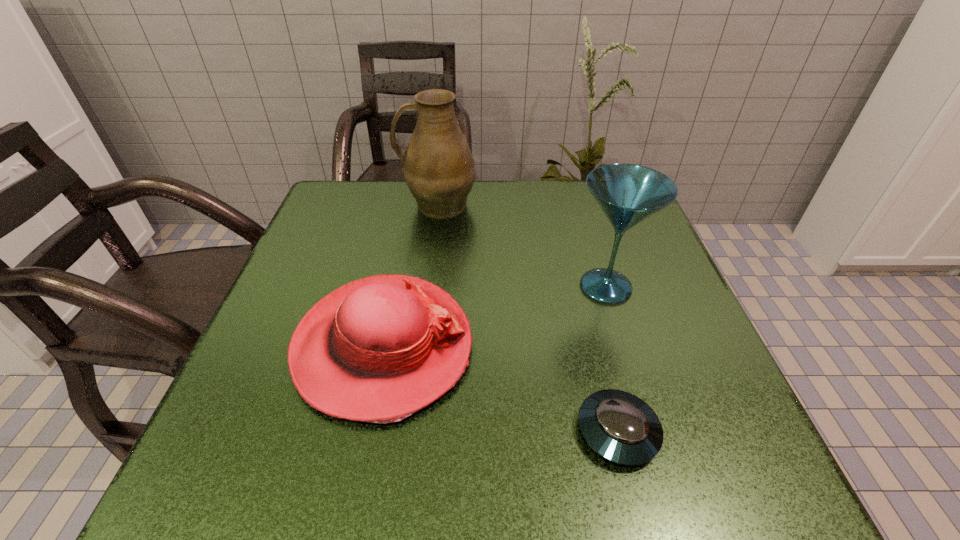
You are a GUI agent. You are given a task and a screenshot of the screen. Output one action in this format:
    pyautogui.click(x=<x>, y=<y>)
    Task: Click on the object located in the far edge section of the desktop
    The image size is (960, 540).
    Given the screenshot: What is the action you would take?
    click(x=438, y=167)

Where is `object that is at the near edge`? object that is at the near edge is located at coordinates (622, 428).

This screenshot has height=540, width=960. Identify the location of object that is at the left edge. (379, 349).

Locate an element on the screen. The width and height of the screenshot is (960, 540). martini that is at the right edge is located at coordinates (628, 194).

This screenshot has width=960, height=540. Identify the location of saucer situated at the right edge. [x=622, y=428].

At what (x,y) coordinates should I click in order to perform the action: click on object that is positioned at the near right corner. Please return your answer as a coordinate pair (x, y). Looking at the image, I should click on (622, 428).

Locate an element on the screen. The image size is (960, 540). free space at the far edge is located at coordinates (523, 197).

You are a GUI agent. You are given a task and a screenshot of the screen. Output one action in this format:
    pyautogui.click(x=<x>, y=<y>)
    Task: Click on the vacant area at the near edge of the desktop
    This screenshot has height=540, width=960.
    Given the screenshot: What is the action you would take?
    coord(578,487)

Find the location of `vacant space at the right edge`. vacant space at the right edge is located at coordinates (670, 401).

Image resolution: width=960 pixels, height=540 pixels. What are the coordinates of `vacant space at the far left corner of the desktop` in the screenshot? It's located at (354, 180).